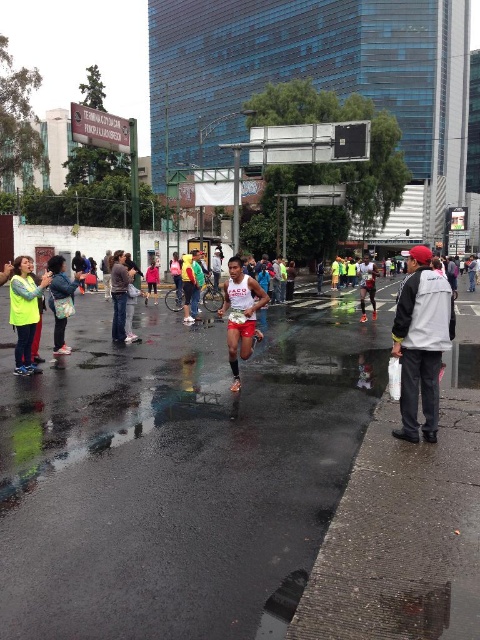
Between matte black shorts at center and pink fabric jacket at center, which one has less height?

Standing shorter between the two is pink fabric jacket at center.

From the picture: Is matte black shorts at center below pink fabric jacket at center?

No.

Between point (367, 285) and point (153, 259), which one is positioned in front?

Point (367, 285)

At what (x,y) coordinates should I click in order to perform the action: click on matte black shorts at center. Please return your answer as a coordinate pair (x, y). The height and width of the screenshot is (640, 480). Looking at the image, I should click on tap(367, 285).

Which of these two, white jacket at right or yellow reflective vest at left, stands shorter?

white jacket at right

Is point (410, 289) farther from viewer compared to point (67, 314)?

That is False.

Who is more forward, (422, 305) or (72, 308)?

Point (422, 305) is in front.

This screenshot has height=640, width=480. Find the location of `white jacket at right`. white jacket at right is located at coordinates (421, 342).

Between point (235, 296) and point (118, 324), which one is positioned behind?

The point (118, 324) is more distant.

Where is `red matte shorts at center`? The height and width of the screenshot is (640, 480). red matte shorts at center is located at coordinates (240, 314).